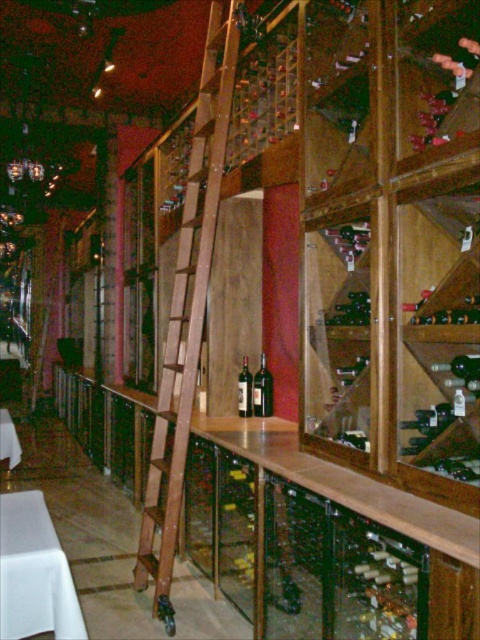
Does wooden wine rack at center appear on the left side of white fabric table at lower left?

In fact, wooden wine rack at center is to the right of white fabric table at lower left.

Is point (396, 349) farther from viewer compared to point (7, 412)?

That is False.

Is point (300, 422) less distant than point (16, 444)?

Yes, point (300, 422) is closer to viewer.

I want to click on wooden wine rack at center, so click(x=392, y=241).

The width and height of the screenshot is (480, 640). What do you see at coordinates (188, 307) in the screenshot?
I see `brown wooden ladder at center` at bounding box center [188, 307].

Is brown wooden ladder at center taller than dark glass bottle at center?

Yes.

Does point (187, 426) come in front of point (262, 392)?

Yes, point (187, 426) is in front of point (262, 392).

Identify the location of brown wooden ladder at center. Image resolution: width=480 pixels, height=640 pixels. (188, 307).

Between wooden wine rack at center and brown wooden ladder at center, which one appears on the right side from the viewer's perspective?

From the viewer's perspective, wooden wine rack at center appears more on the right side.

Does wooden wine rack at center have a greater height compared to brown wooden ladder at center?

No, wooden wine rack at center is not taller than brown wooden ladder at center.

Measure the distance between wooden wine rack at center and camera.

A distance of 1.63 meters exists between wooden wine rack at center and camera.

Locate an element on the screen. wooden wine rack at center is located at coordinates (392, 241).